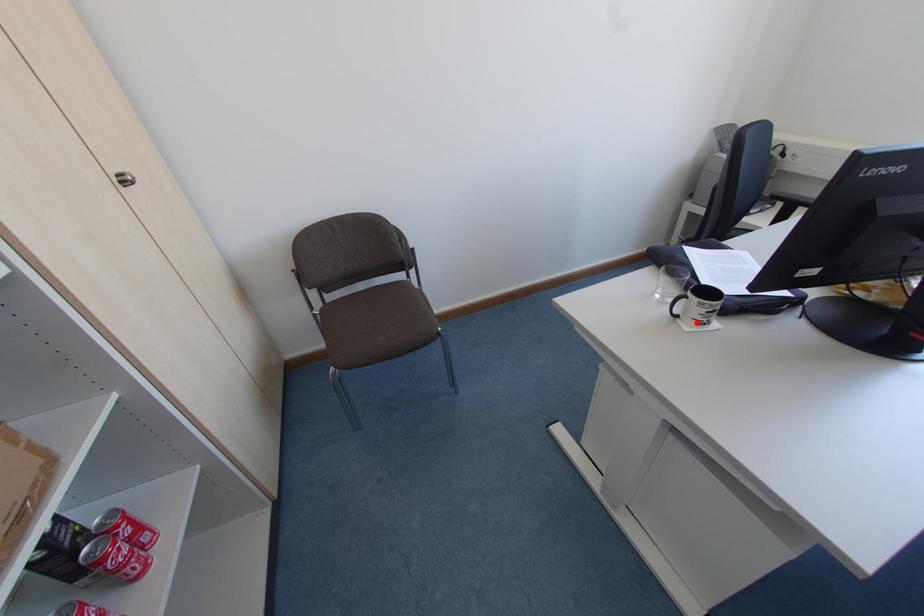
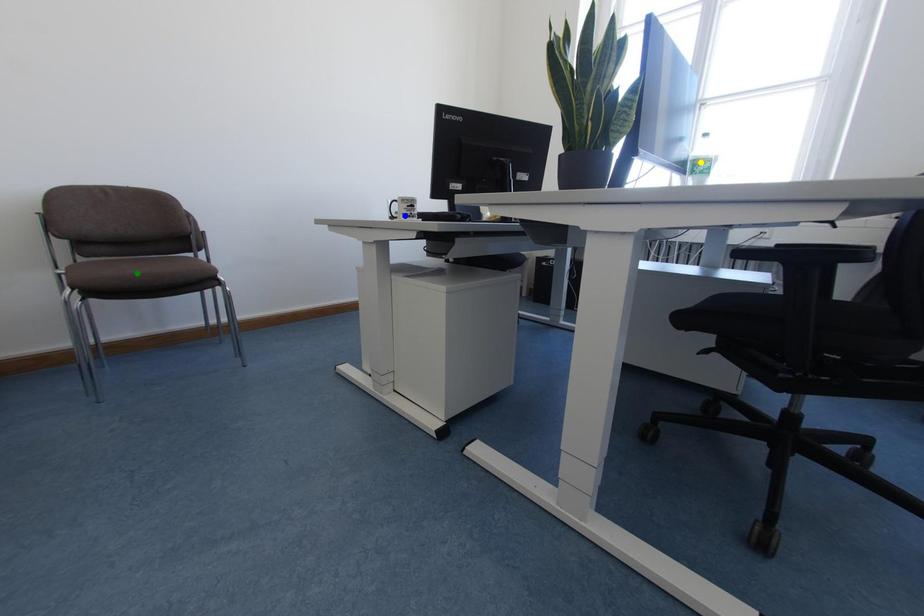
Question: I am providing you with two images of the same scene from different viewpoints. A red point is marked on the first image. You are given multiple points on the second image. Which spot in image 2 lines up with the point in image 1?

Choices:
 (A) yellow point
 (B) green point
 (C) blue point

Answer: (C)